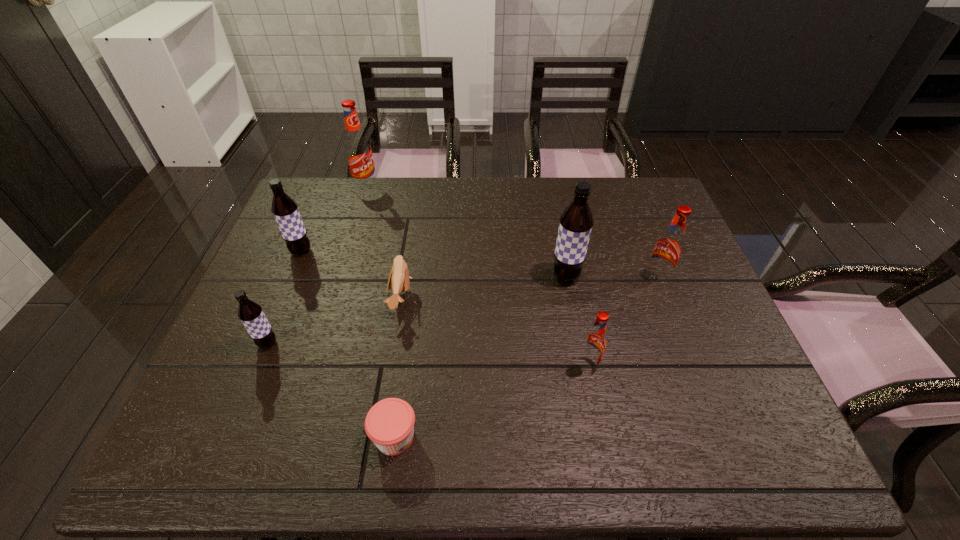
Where is `vacant space that is in between the seventh nearest object and the farthest root beer`? vacant space that is in between the seventh nearest object and the farthest root beer is located at coordinates (334, 219).

Identify which object is the third nearest to the second shortest object. Please provide its 2D coordinates. Your answer should be formatted as a tuple, i.e. [(x, y)], where the tuple contains the x and y coordinates of a point satisfying the conditions above.

[(285, 210)]

Identify which object is the second nearest to the rightmost root beer. Please provide its 2D coordinates. Your answer should be formatted as a tuple, i.e. [(x, y)], where the tuple contains the x and y coordinates of a point satisfying the conditions above.

[(594, 344)]

Locate an element on the screen. This screenshot has height=540, width=960. the closest root beer to the farthest red root beer is located at coordinates (285, 210).

What are the coordinates of `the fourth closest root beer to the jam` in the screenshot? It's located at (285, 210).

Locate which red root beer ranks in proximity to the second farthest object. Please provide its 2D coordinates. Your answer should be formatted as a tuple, i.e. [(x, y)], where the tuple contains the x and y coordinates of a point satisfying the conditions above.

[(358, 151)]

Where is `the closest red root beer to the nearest red root beer`? the closest red root beer to the nearest red root beer is located at coordinates (669, 247).

Identify the location of the closest brown root beer to the sixth farthest object. (285, 210).

Point out which brown root beer is positioned as the third nearest to the nearest red root beer. Please provide its 2D coordinates. Your answer should be formatted as a tuple, i.e. [(x, y)], where the tuple contains the x and y coordinates of a point satisfying the conditions above.

[(285, 210)]

Find the location of a particular element. Image resolution: width=960 pixels, height=540 pixels. blank space that satisfies the following two spatial constraints: 1. at the beak of the second shortest object; 2. on the right side of the nearest root beer is located at coordinates (390, 365).